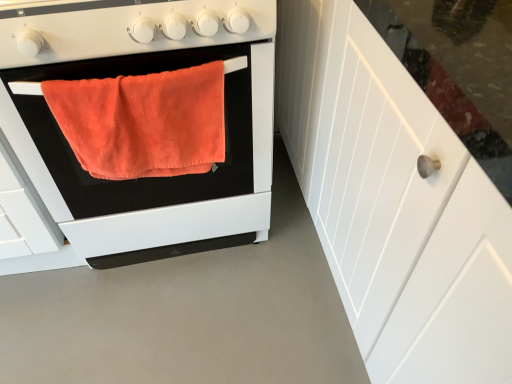
In order to click on vacant area that is in front of orange fabric towel at left in this screenshot , I will do `click(165, 322)`.